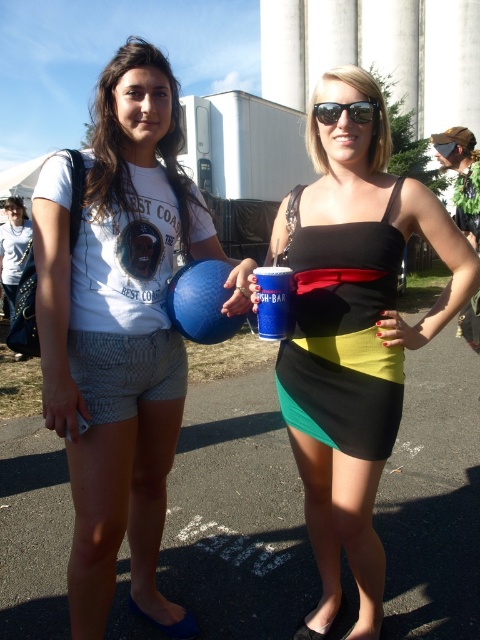
Question: Which point appears farthest from the camera in this image?

Choices:
 (A) [x=360, y=112]
 (B) [x=108, y=138]
 (C) [x=407, y=230]

Answer: (C)

Question: Which point is farther to the camera?

Choices:
 (A) (106, 138)
 (B) (368, 419)
 (C) (51, 371)
 (D) (328, 108)

Answer: (A)

Question: Is the position of matte white t-shirt at left more distant than that of sunglasses at center?

Choices:
 (A) no
 (B) yes

Answer: (A)

Question: Which of the following is the closest to the observer?

Choices:
 (A) blue rubber balloon at center
 (B) matte white t-shirt at left
 (C) white cotton t-shirt at upper left

Answer: (B)

Question: Does black matte dress at center appear on the right side of sunglasses at center?

Choices:
 (A) yes
 (B) no

Answer: (B)

Question: Does white cotton t-shirt at upper left have a lesser width compared to sunglasses at center?

Choices:
 (A) yes
 (B) no

Answer: (B)